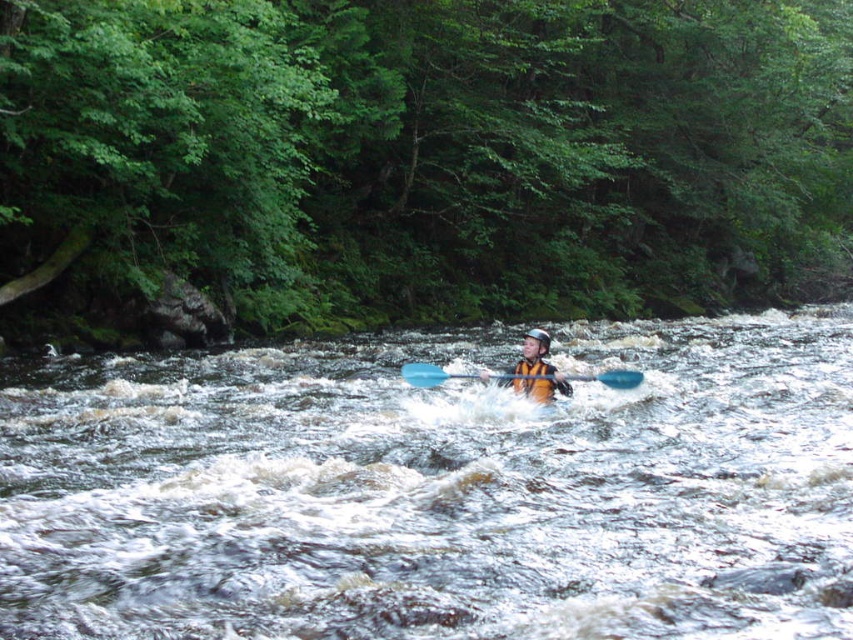
Question: Is yellow life jacket at center closer to the viewer compared to blue plastic paddle at center?

Choices:
 (A) yes
 (B) no

Answer: (B)

Question: Which object is farther from the camera taking this photo?

Choices:
 (A) yellow life jacket at center
 (B) white frothy water at center
 (C) blue plastic paddle at center

Answer: (A)

Question: Which object appears closest to the camera in this image?

Choices:
 (A) yellow life jacket at center
 (B) blue plastic paddle at center
 (C) white frothy water at center

Answer: (C)

Question: Which point is closer to the camera?

Choices:
 (A) (529, 380)
 (B) (547, 397)

Answer: (A)

Question: Considering the relative positions of white frothy water at center and yellow life jacket at center in the image provided, where is white frothy water at center located with respect to yellow life jacket at center?

Choices:
 (A) below
 (B) above

Answer: (A)

Question: Is white frothy water at center behind yellow life jacket at center?

Choices:
 (A) no
 (B) yes

Answer: (A)